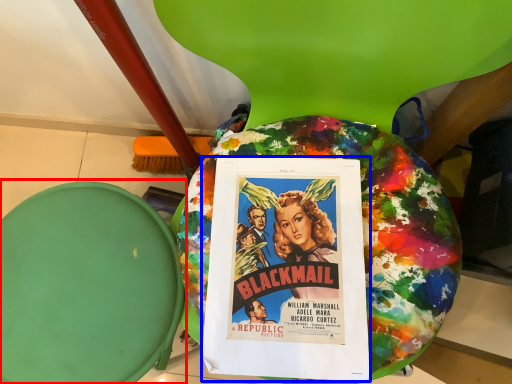
Question: Which point is further to the camera, bean bag chair (highlighted by a red box) or poster (highlighted by a blue box)?

Choices:
 (A) bean bag chair
 (B) poster

Answer: (A)